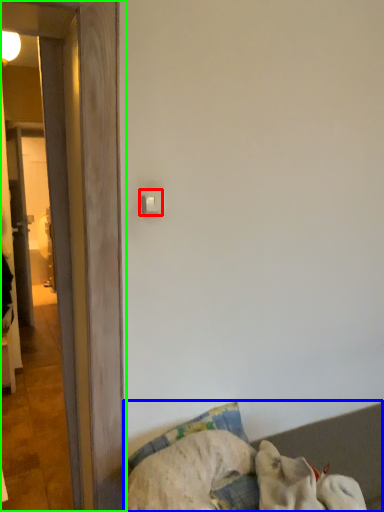
Question: Which is farther away from light switch (highlighted by a red box)? furniture (highlighted by a blue box) or door (highlighted by a green box)?

Choices:
 (A) furniture
 (B) door

Answer: (A)